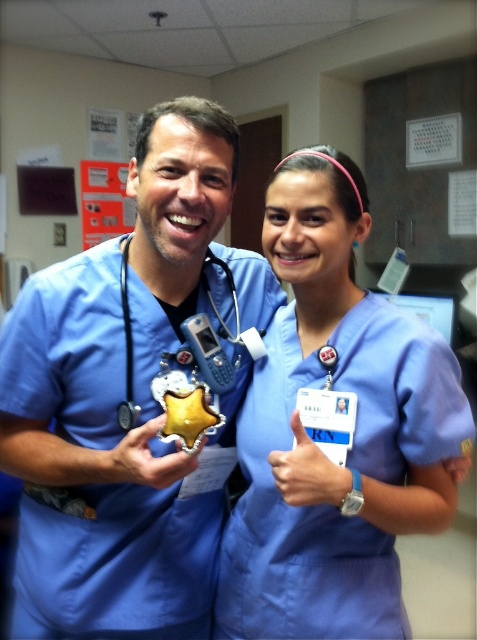
What is located at the coordinates point (308,472) in the image?

The point (308,472) corresponds to the blue fabric hand at center.

You are a delivery robot in a hospital. You need to deliver a package to the point marked at coordinates point (155, 342). The package is 12 inches in diameter. Can you fit the package at that point without overlapping other objects?

The point (155, 342) is 38.99 inches from the camera, so the package with 12 inches diameter can fit there without overlapping other objects since there is enough space.

You are a patient in the hospital and see the blue scrubs at center and the blue fabric hand at center. Which one is larger in size?

The blue scrubs at center is bigger than the blue fabric hand at center.